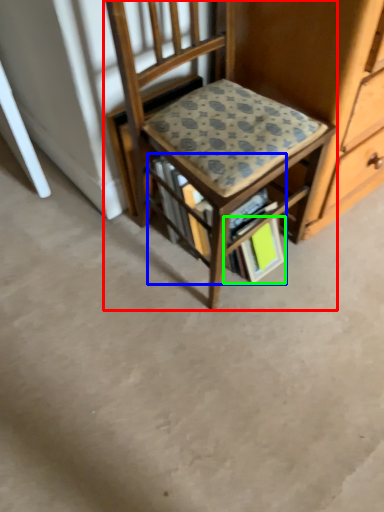
Question: Which object is positioned closest to chair (highlighted by a red box)? Select from book (highlighted by a blue box) and paperback book (highlighted by a green box).

Choices:
 (A) book
 (B) paperback book

Answer: (A)